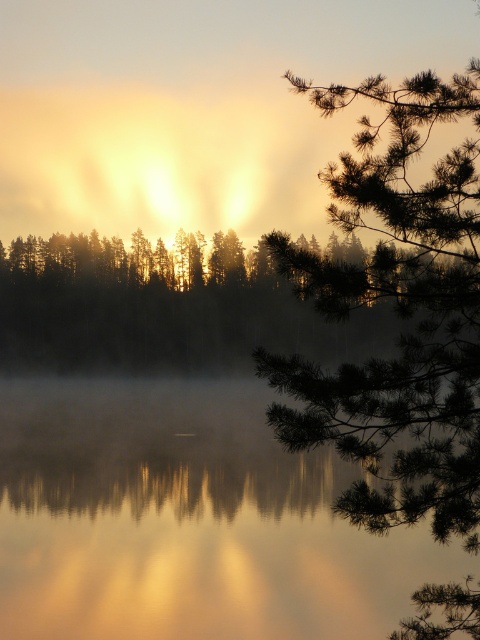
Which is more to the left, green needle-like branches at upper right or silvery metallic trees at center?

silvery metallic trees at center

Who is more distant from viewer, (297, 385) or (108, 296)?

Point (108, 296)

The image size is (480, 640). Identify the location of green needle-like branches at upper right. (398, 312).

How distant is glossy reflective water at center from green needle-like branches at upper right?

The distance of glossy reflective water at center from green needle-like branches at upper right is 16.09 meters.

Is point (33, 417) closer to camera compared to point (460, 412)?

No, (33, 417) is behind (460, 412).

Identify the location of glossy reflective water at center. (187, 520).

Who is more forward, (178, 589) or (37, 358)?

Positioned in front is point (178, 589).

Can you confirm if glossy reflective water at center is wider than silvery metallic trees at center?

Correct, the width of glossy reflective water at center exceeds that of silvery metallic trees at center.

The width and height of the screenshot is (480, 640). Describe the element at coordinates (187, 520) in the screenshot. I see `glossy reflective water at center` at that location.

Identify the location of glossy reflective water at center. This screenshot has width=480, height=640. (187, 520).